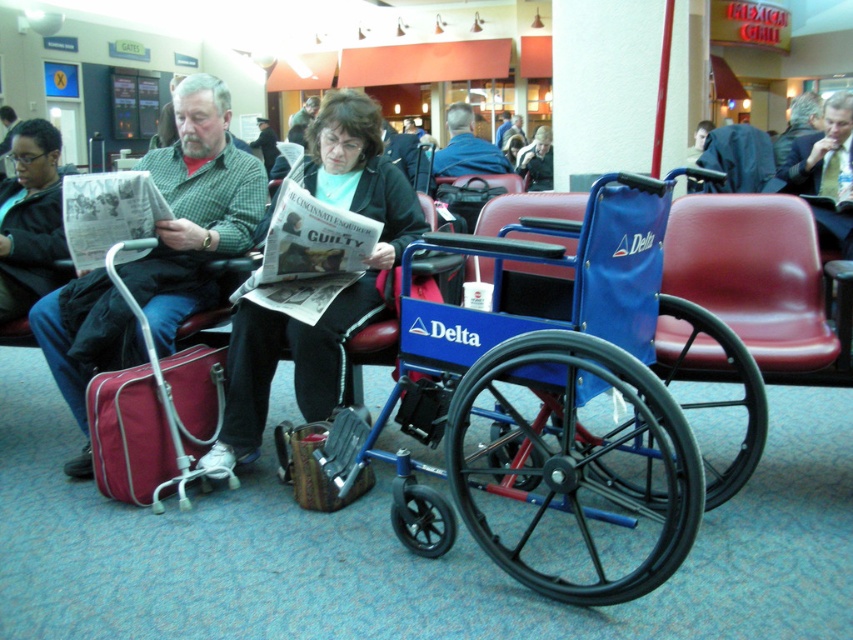
You are a person standing at the entrance of the airport terminal. You see a matte green shirt at center and a dark gray sweater at center. Which one is closer to you?

The matte green shirt at center is positioned under the dark gray sweater at center, so the dark gray sweater at center is closer to you.

You are a traveler who needs to stow your luggage under the seat in front of you. The luggage compartment can only accommodate items up to 22 inches in height. Given the blue plastic wheelchair at center and the maroon fabric suitcase at left, which item is more likely to exceed the height limit?

The blue plastic wheelchair at center is much taller than the maroon fabric suitcase at left, so it is more likely to exceed the 22 inches height limit.

You are a traveler who needs to retrieve your maroon fabric suitcase at left from its current location. Can you lift it without moving the blue plastic wheelchair at center first?

The blue plastic wheelchair at center is positioned under the maroon fabric suitcase at left. Since the wheelchair is blocking access to the suitcase, you would need to move the blue plastic wheelchair at center first before you can retrieve the maroon fabric suitcase at left.